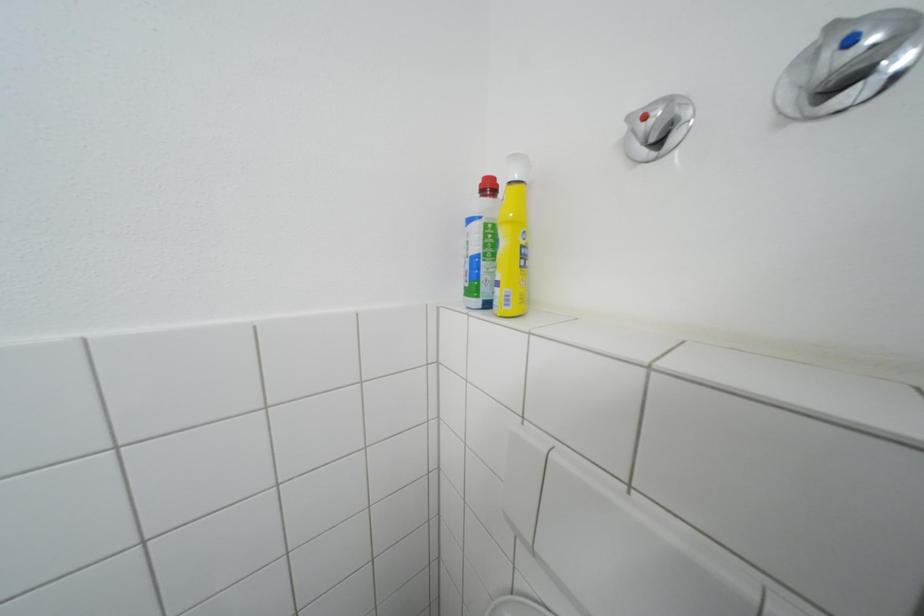
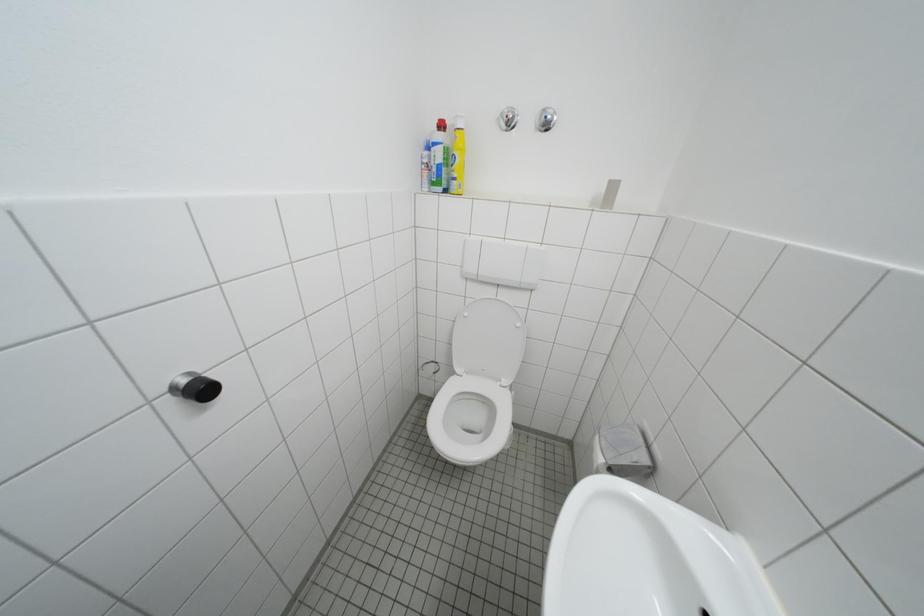
How did the camera likely rotate?

The camera's rotation is toward right-down.